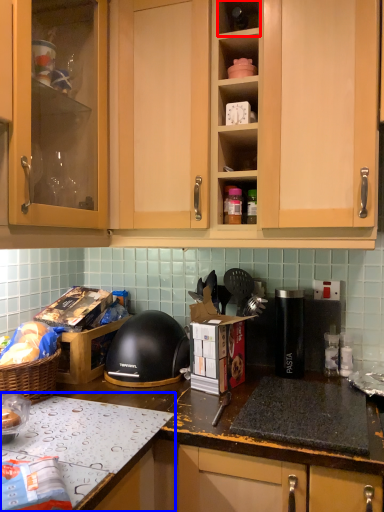
Question: Which object appears closest to the camera in this image, shelf (highlighted by a red box) or countertop (highlighted by a blue box)?

Choices:
 (A) shelf
 (B) countertop

Answer: (B)